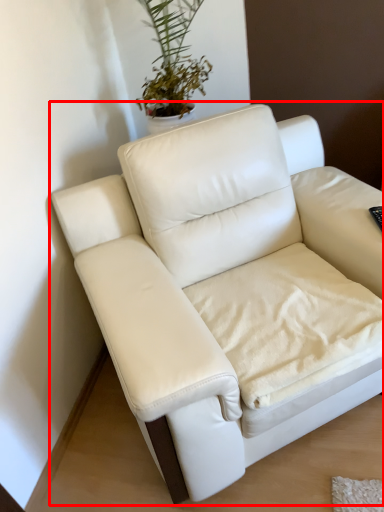
Question: From the image, what is the correct spatial relationship of studio couch (annotated by the red box) in relation to sheet?

Choices:
 (A) left
 (B) right

Answer: (A)